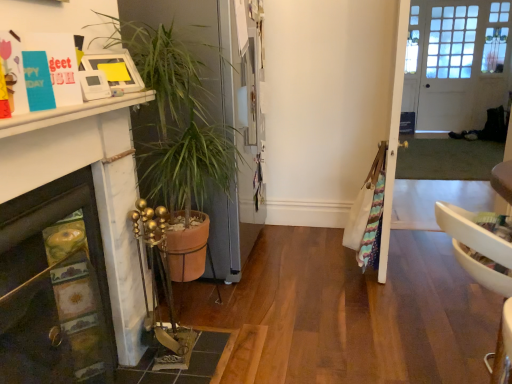
Question: In the image, is clear glass door at center positioned in front of or behind white wooden door at upper right?

Choices:
 (A) behind
 (B) front

Answer: (B)

Question: From the image's perspective, relative to white wooden door at upper right, is clear glass door at center above or below?

Choices:
 (A) above
 (B) below

Answer: (B)

Question: Considering the real-world distances, which object is closest to the marble fireplace at lower left?

Choices:
 (A) matte brown tile at lower left
 (B) clear glass door at center
 (C) white wooden door at upper right
 (D) terracotta pot at left

Answer: (A)

Question: Which of these objects is positioned farthest from the matte brown tile at lower left?

Choices:
 (A) clear glass door at center
 (B) marble fireplace at lower left
 (C) white wooden door at upper right
 (D) terracotta pot at left

Answer: (C)